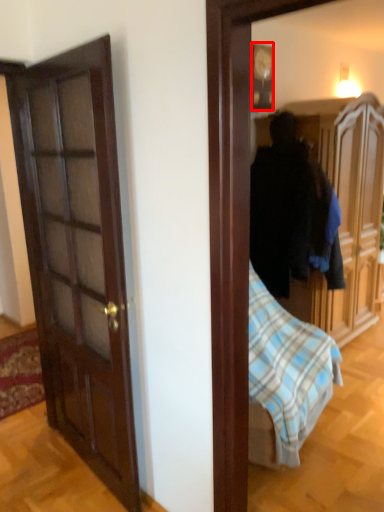
Question: Observing the image, what is the correct spatial positioning of picture frame (annotated by the red box) in reference to cabinetry?

Choices:
 (A) right
 (B) left

Answer: (B)